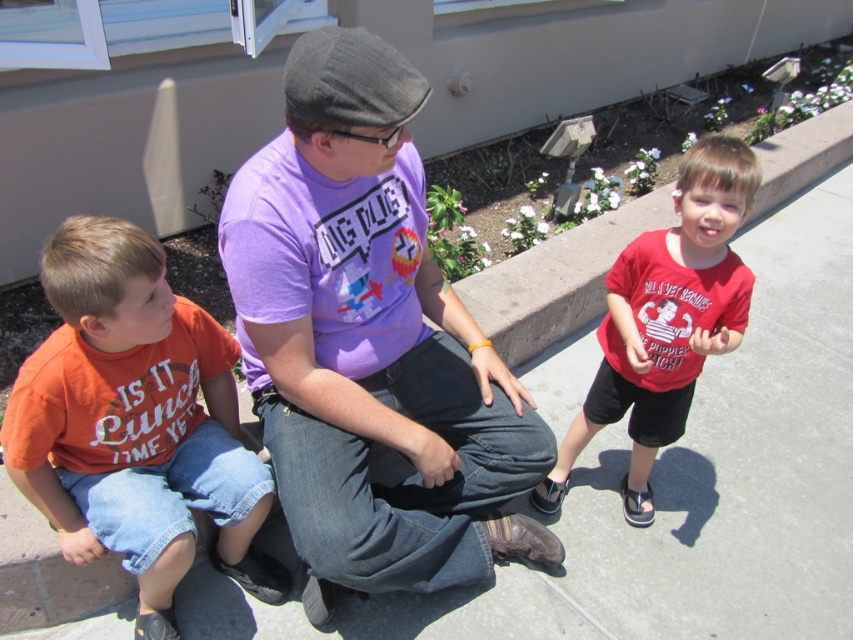
Question: Which object appears closest to the camera in this image?

Choices:
 (A) purple cotton shirt at center
 (B) orange cotton shirt at left
 (C) red matte shirt at right

Answer: (B)

Question: Does orange cotton shirt at left have a smaller size compared to red matte shirt at right?

Choices:
 (A) no
 (B) yes

Answer: (B)

Question: Does purple cotton shirt at center appear on the left side of red matte shirt at right?

Choices:
 (A) no
 (B) yes

Answer: (B)

Question: Estimate the real-world distances between objects in this image. Which object is farther from the red matte shirt at right?

Choices:
 (A) orange cotton shirt at left
 (B) purple cotton shirt at center

Answer: (A)

Question: Is purple cotton shirt at center positioned at the back of red matte shirt at right?

Choices:
 (A) no
 (B) yes

Answer: (A)

Question: Which object is farther from the camera taking this photo?

Choices:
 (A) purple cotton shirt at center
 (B) orange cotton shirt at left
 (C) red matte shirt at right

Answer: (C)